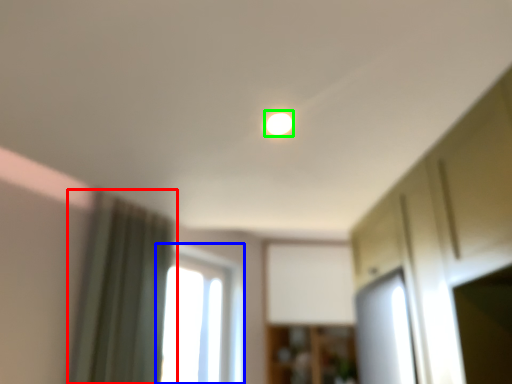
Question: Which object is positioned closest to curtain (highlighted by a red box)? Select from window (highlighted by a blue box) and light (highlighted by a green box).

Choices:
 (A) window
 (B) light

Answer: (B)